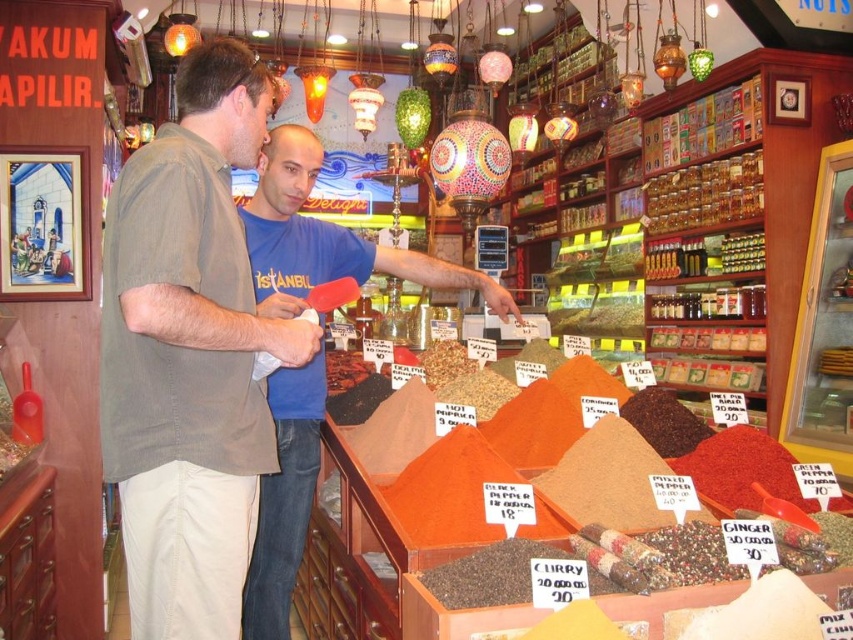
Based on the coordinates provided, which object is located at point (190,353) in the scene?

The light brown cotton shirt at center is located at point (190,353).